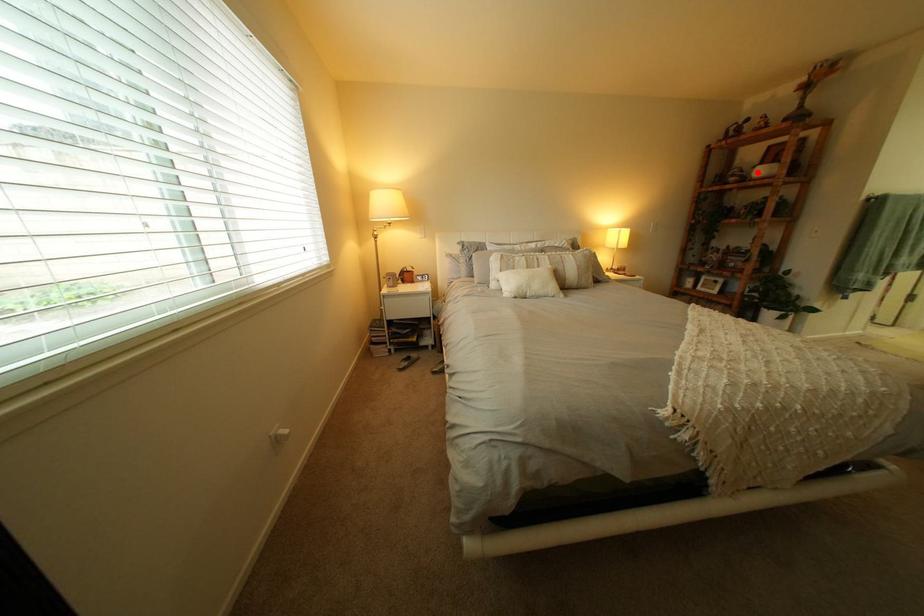
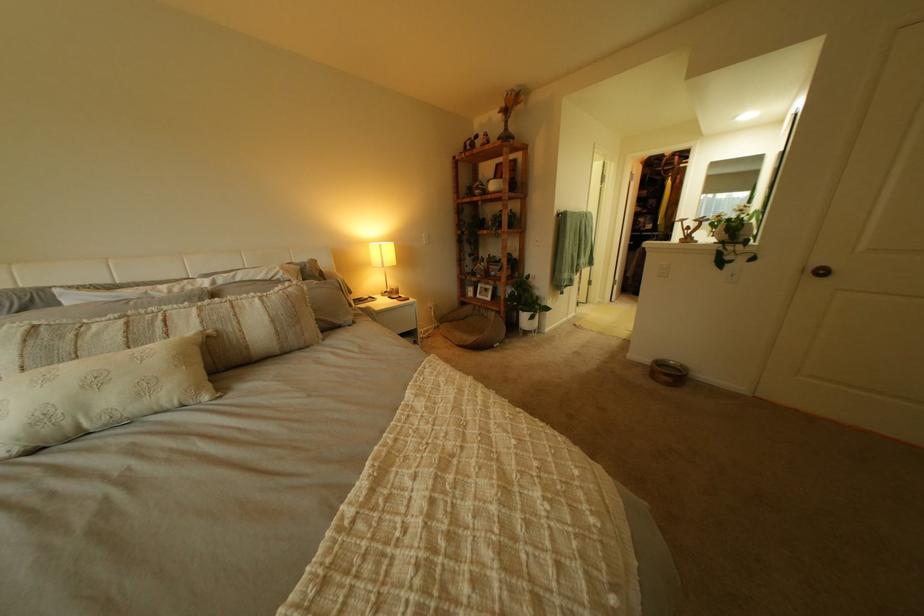
Find the pixel in the second image that matches the highlighted location in the first image.

(497, 185)